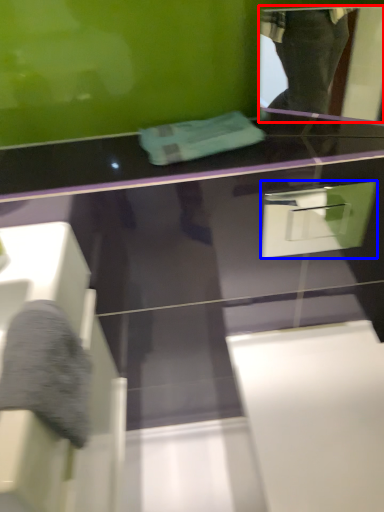
Question: Among these objects, which one is nearest to the camera, mirror (highlighted by a red box) or drawer (highlighted by a blue box)?

Choices:
 (A) mirror
 (B) drawer

Answer: (A)